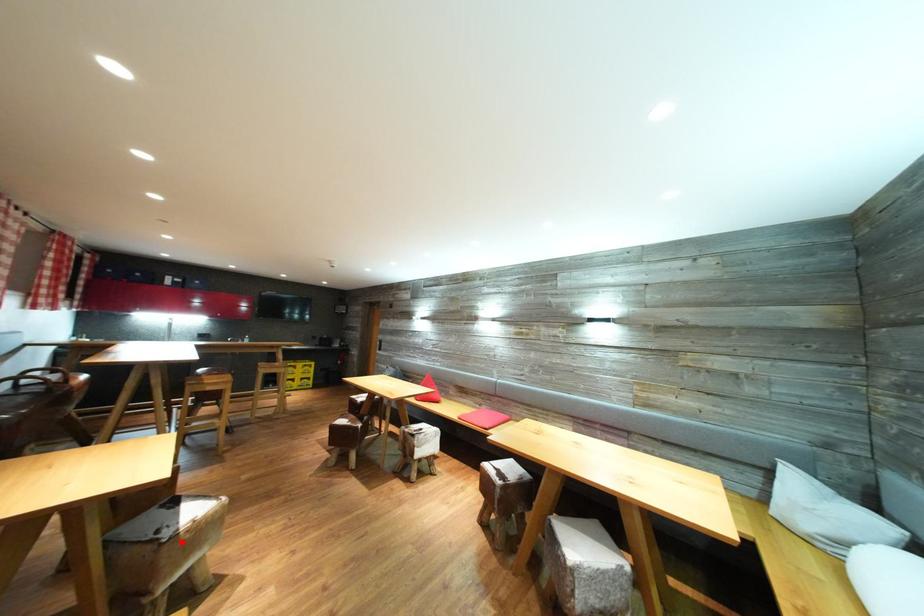
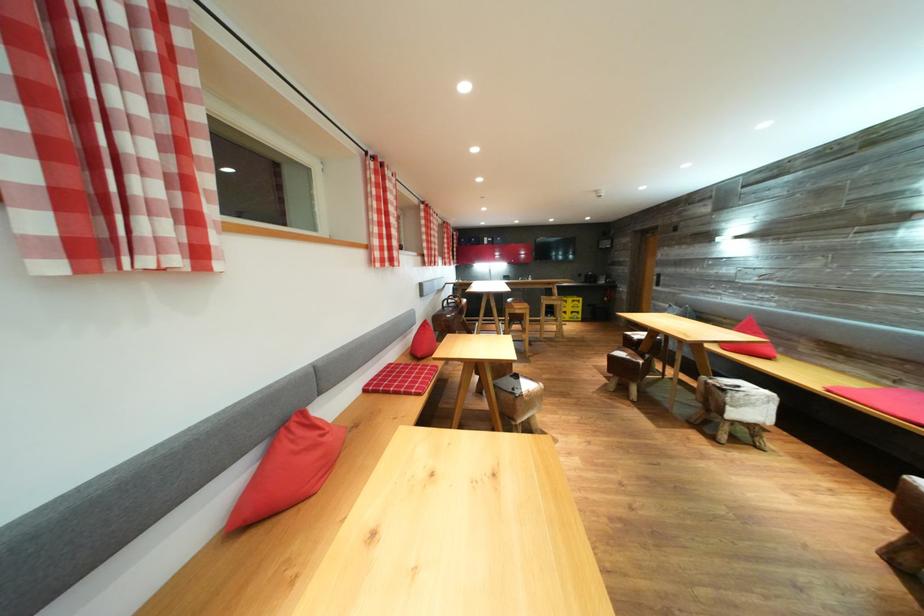
Question: I am providing you with two images of the same scene from different viewpoints. A red point is marked on the first image. Is the red point's position out of view in image 2?

Choices:
 (A) Yes
 (B) No

Answer: (B)